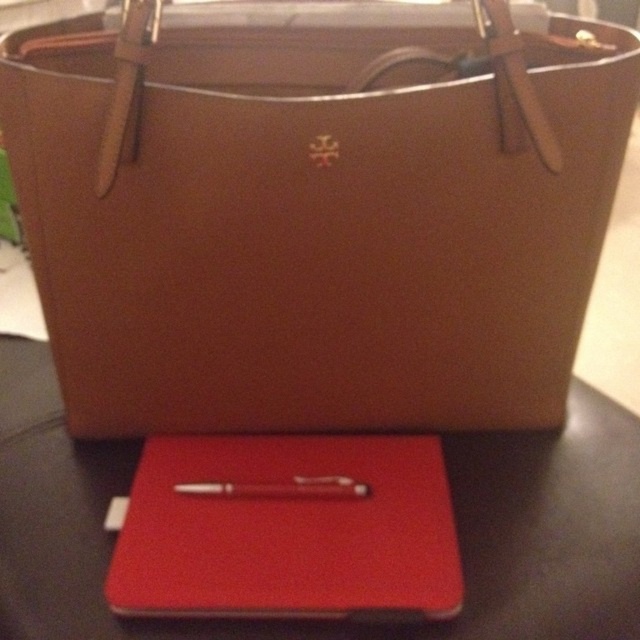
You are organizing your desk and see the rubberized red notebook at center and the matte red pen at center. Which item takes up more space on the desk?

The rubberized red notebook at center is bigger than the matte red pen at center, so it takes up more space on the desk.

You are organizing your desk and need to place the rubberized red notebook at center. Where should you place it?

You should place the rubberized red notebook at center at point (289, 529).

You are organizing your workspace and need to place both the black leather table at center and the rubberized red notebook at center. Which object should you move first to ensure the other fits properly?

You should move the black leather table at center first because it is larger in size than the rubberized red notebook at center, so moving the larger item first will make it easier to accommodate the smaller one.